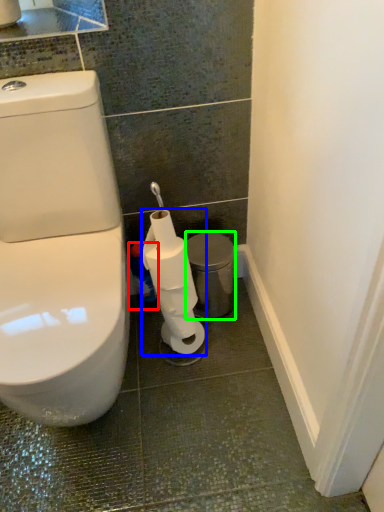
Question: Which object is positioned closest to cleaning product (highlighted by a red box)? Select from toilet paper (highlighted by a blue box) and porcelain (highlighted by a green box).

Choices:
 (A) toilet paper
 (B) porcelain

Answer: (B)